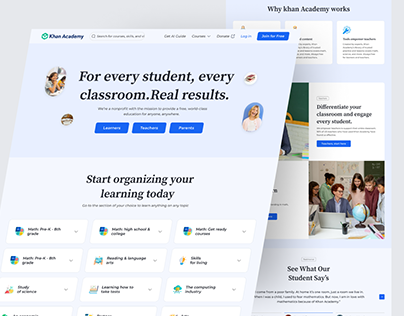
Identify the location of base of globe. (362, 226).